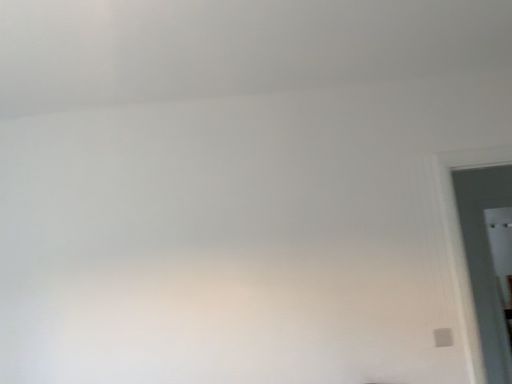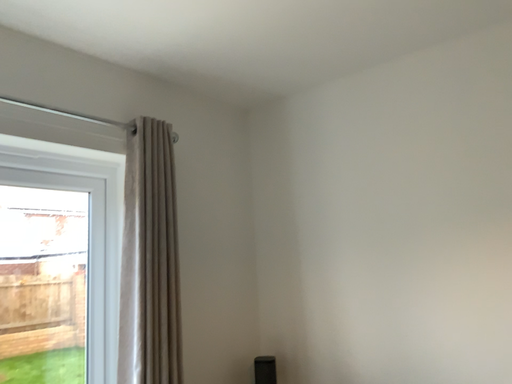
Question: Which way did the camera rotate in the video?

Choices:
 (A) rotated left
 (B) rotated right

Answer: (A)